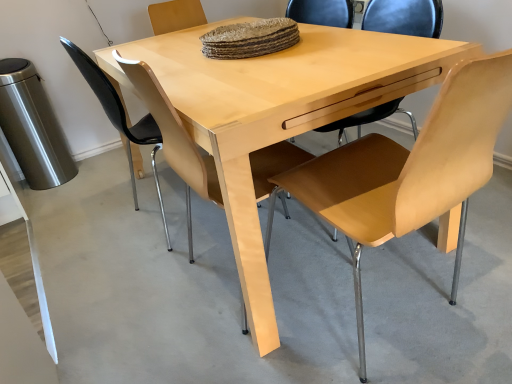
Locate an element on the screen. The height and width of the screenshot is (384, 512). vacant area that lies to the right of brown woven mat at center is located at coordinates (345, 41).